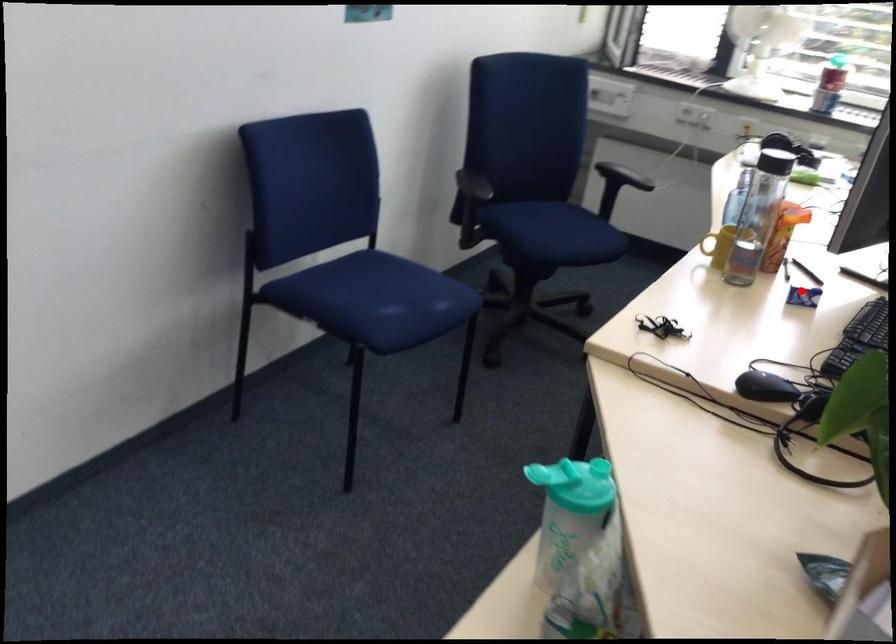
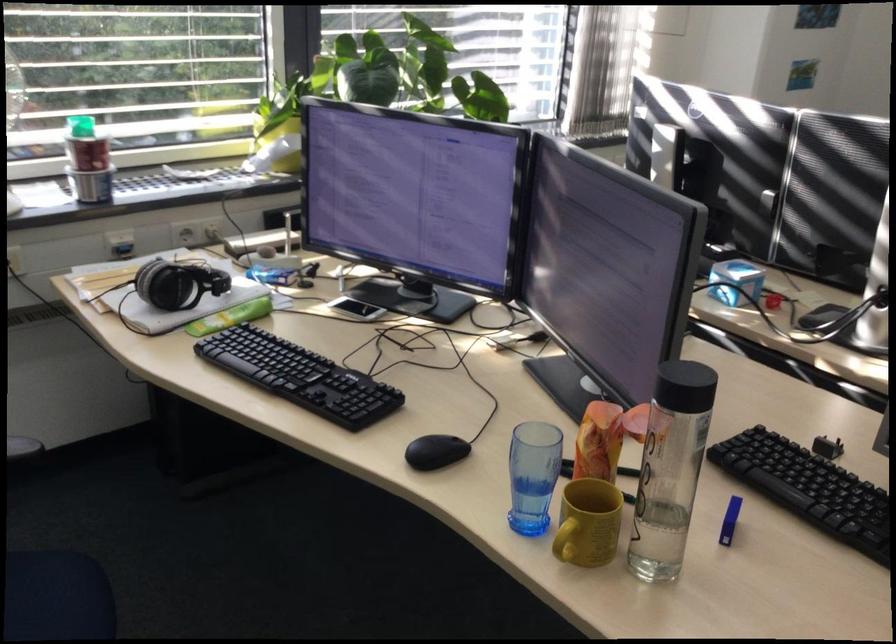
Question: I am providing you with two images of the same scene from different viewpoints. A red point is shown in image1. For the corresponding object point in image2, is it positioned nearer or farther from the camera?

Choices:
 (A) Nearer
 (B) Farther

Answer: (A)